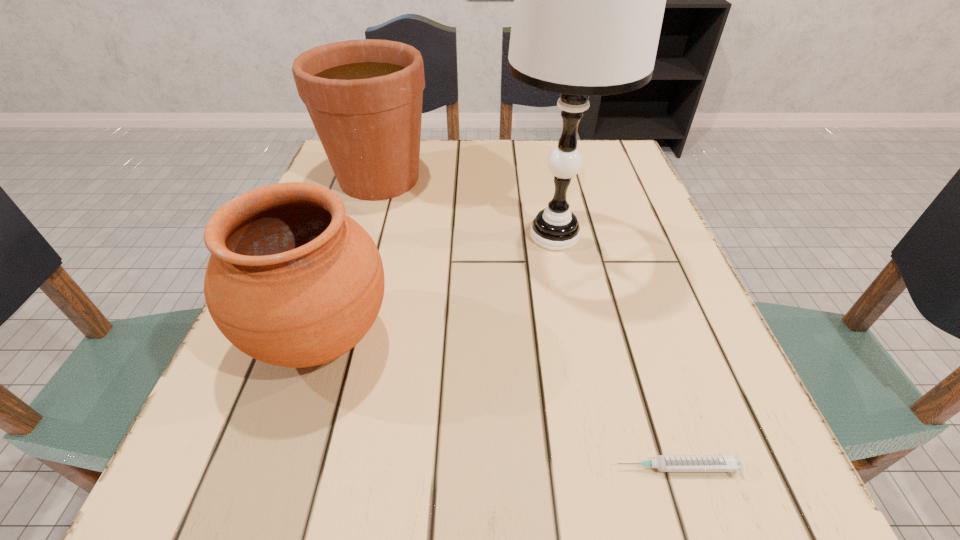
The height and width of the screenshot is (540, 960). In order to click on vacant position at the near edge of the desktop in this screenshot , I will do `click(563, 519)`.

The width and height of the screenshot is (960, 540). I want to click on free space at the left edge of the desktop, so click(371, 204).

Where is `vacant space at the right edge`? vacant space at the right edge is located at coordinates (666, 248).

I want to click on free space that is in between the tallest object and the flowerpot, so click(x=467, y=207).

The height and width of the screenshot is (540, 960). What are the coordinates of `vacant space that is in between the flowerpot and the table lamp` in the screenshot? It's located at (467, 207).

Find the location of a particular element. vacant area that lies between the third farthest object and the tallest object is located at coordinates (438, 287).

I want to click on vacant point located between the flowerpot and the table lamp, so click(x=467, y=207).

This screenshot has width=960, height=540. In order to click on vacant space that's between the tallest object and the pottery in this screenshot , I will do `click(438, 287)`.

You are a GUI agent. You are given a task and a screenshot of the screen. Output one action in this format:
    pyautogui.click(x=<x>, y=<y>)
    Task: Click on the vacant space that is in between the pottery and the tallest object
    This screenshot has width=960, height=540.
    Given the screenshot: What is the action you would take?
    pyautogui.click(x=438, y=287)

I want to click on vacant region between the table lamp and the pottery, so click(x=438, y=287).